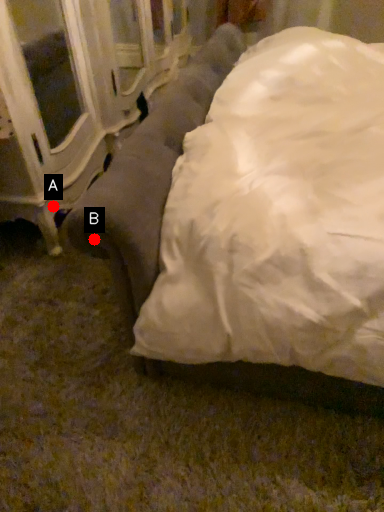
Question: Two points are circled on the image, labeled by A and B beside each circle. Which point is farther to the camera?

Choices:
 (A) A is further
 (B) B is further

Answer: (A)